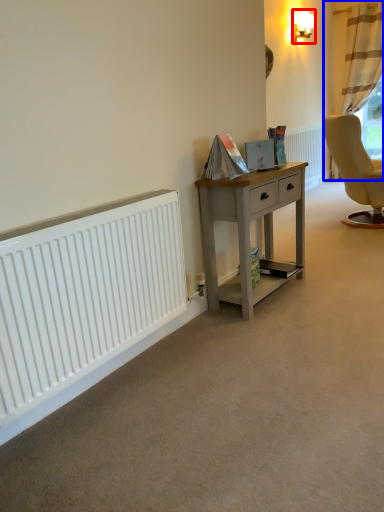
Question: Which of the following is the closest to the observer, lamp (highlighted by a red box) or curtain (highlighted by a blue box)?

Choices:
 (A) lamp
 (B) curtain

Answer: (A)